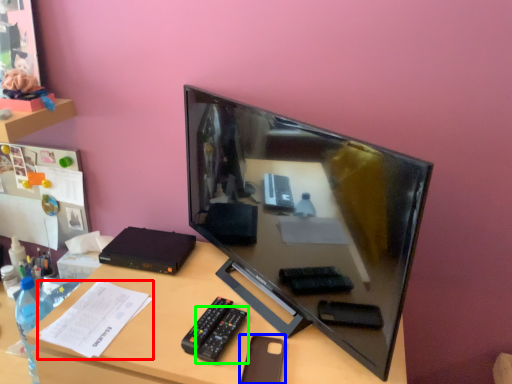
Question: Based on their relative distances, which object is nearer to paper (highlighted by a red box)? Choose from stationery (highlighted by a blue box) and remote (highlighted by a green box).

Choices:
 (A) stationery
 (B) remote

Answer: (B)